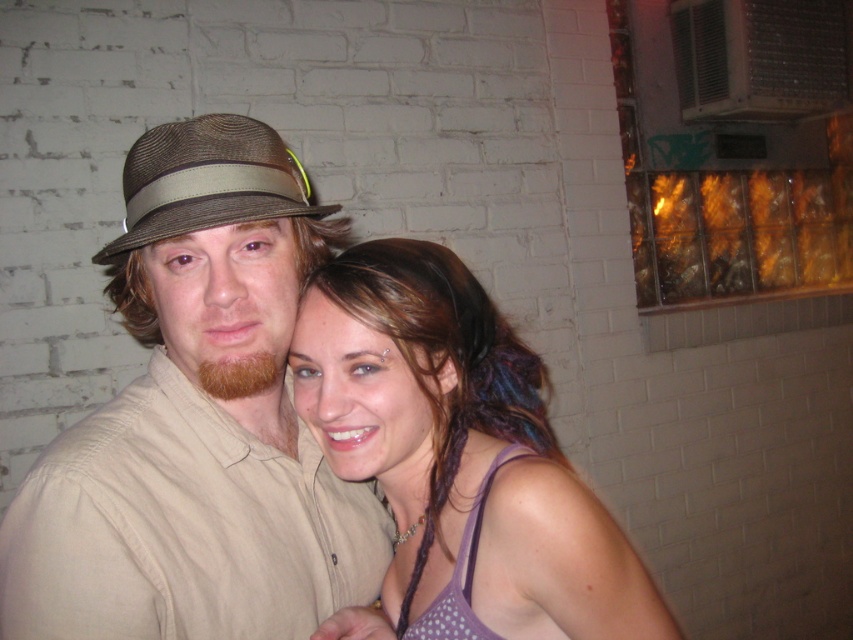
What do you see at coordinates (196, 422) in the screenshot? I see `matte brown hat at center` at bounding box center [196, 422].

Can you confirm if matte brown hat at center is taller than purple dotted tank top at center?

Yes, matte brown hat at center is taller than purple dotted tank top at center.

Is point (288, 180) positioned after point (491, 317)?

No, it is not.

Find the location of a particular element. This screenshot has height=640, width=853. matte brown hat at center is located at coordinates (196, 422).

Is purple dotted tank top at center above brown woven hat at left?

Incorrect, purple dotted tank top at center is not positioned above brown woven hat at left.

Is purple dotted tank top at center taller than brown woven hat at left?

Yes, purple dotted tank top at center is taller than brown woven hat at left.

Locate an element on the screen. This screenshot has height=640, width=853. purple dotted tank top at center is located at coordinates (457, 460).

In order to click on matte brown hat at center in this screenshot , I will do (196, 422).

Between point (167, 458) and point (149, 189), which one is positioned in front?

Point (149, 189)

Find the location of a particular element. matte brown hat at center is located at coordinates (196, 422).